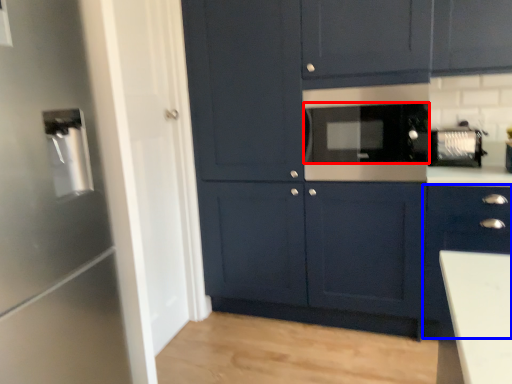
Question: Among these objects, which one is farthest to the camera, appliance (highlighted by a red box) or cabinetry (highlighted by a blue box)?

Choices:
 (A) appliance
 (B) cabinetry

Answer: (A)